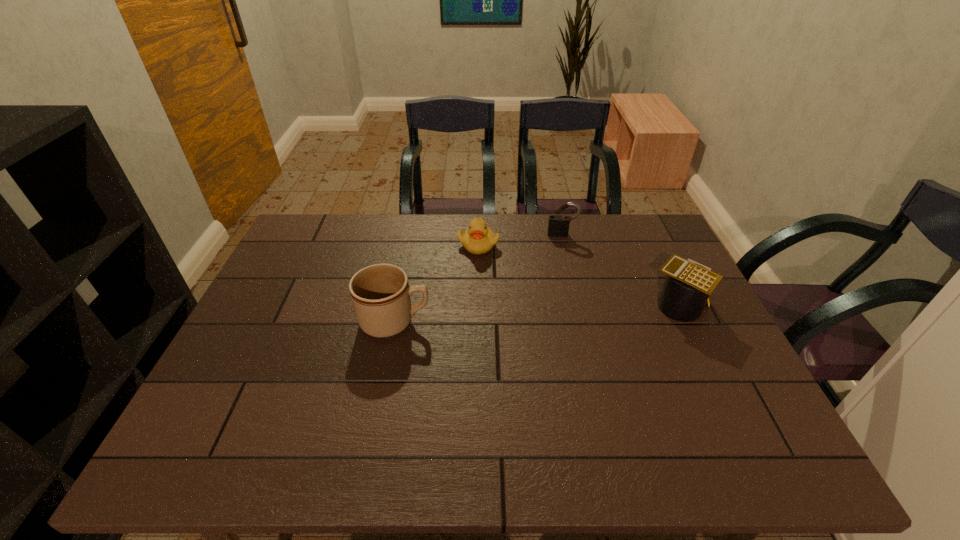
The image size is (960, 540). What are the coordinates of `the leftmost object` in the screenshot? It's located at (380, 293).

Locate an element on the screen. The width and height of the screenshot is (960, 540). calculator is located at coordinates (687, 287).

Find the location of a particular element. The image size is (960, 540). the second object from left to right is located at coordinates (478, 239).

Identify the location of the shortest object. (478, 239).

The height and width of the screenshot is (540, 960). In order to click on padlock in this screenshot , I will do tap(558, 226).

Where is `free space located 0.160m on the side of the leftmost object with the handle`? free space located 0.160m on the side of the leftmost object with the handle is located at coordinates (491, 321).

Find the location of a particular element. The height and width of the screenshot is (540, 960). vacant space situated on the left of the rightmost object is located at coordinates (612, 306).

Locate an element on the screen. The height and width of the screenshot is (540, 960). vacant region located 0.250m on the beak of the shortest object is located at coordinates (519, 308).

Find the location of `vacant position located 0.270m on the beak of the shortest object`. vacant position located 0.270m on the beak of the shortest object is located at coordinates (522, 313).

The width and height of the screenshot is (960, 540). Find the location of `free spot located 0.400m on the beak of the shortest object`. free spot located 0.400m on the beak of the shortest object is located at coordinates (543, 348).